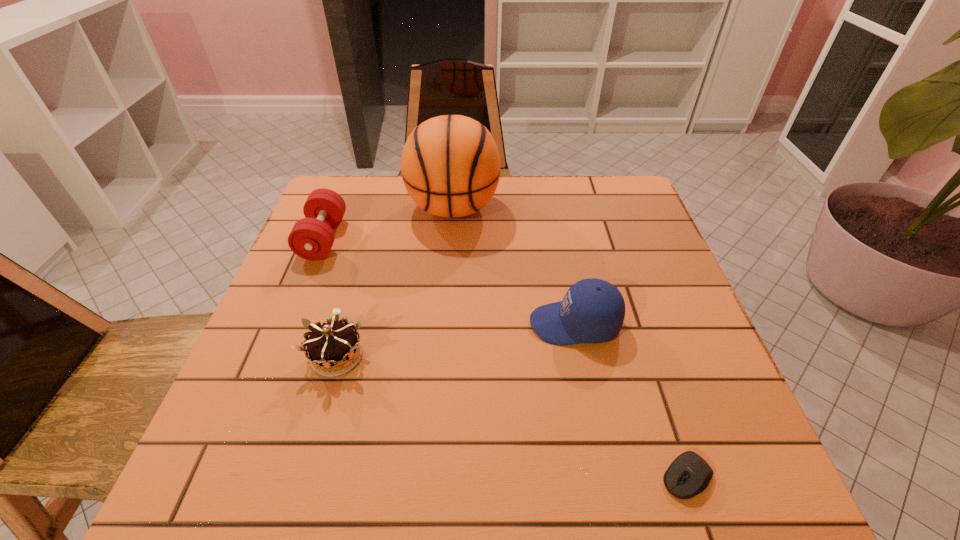
Locate an element on the screen. This screenshot has height=540, width=960. computer equipment that is at the right edge is located at coordinates (689, 474).

You are a GUI agent. You are given a task and a screenshot of the screen. Output one action in this format:
    pyautogui.click(x=<x>, y=<y>)
    Task: Click on the object positioned at the far left corner
    
    Given the screenshot: What is the action you would take?
    (311, 238)

The width and height of the screenshot is (960, 540). I want to click on object located in the near right corner section of the desktop, so click(689, 474).

Find the location of `vacant space at the far edge of the desktop`. vacant space at the far edge of the desktop is located at coordinates (542, 180).

Identify the location of free spot at the near edge of the desktop. (482, 463).

The height and width of the screenshot is (540, 960). I want to click on free point at the left edge, so click(x=285, y=407).

This screenshot has height=540, width=960. What are the coordinates of `free location at the right edge` in the screenshot? It's located at (636, 262).

In the image, there is a desktop. At what (x,y) coordinates should I click in order to perform the action: click on vacant space at the far left corner. Please return your answer as a coordinate pair (x, y). Looking at the image, I should click on (354, 221).

Identify the location of blank space at the near left corner of the desktop. This screenshot has height=540, width=960. (223, 502).

Identify the location of vacant area at the far right corner of the desktop. (592, 180).